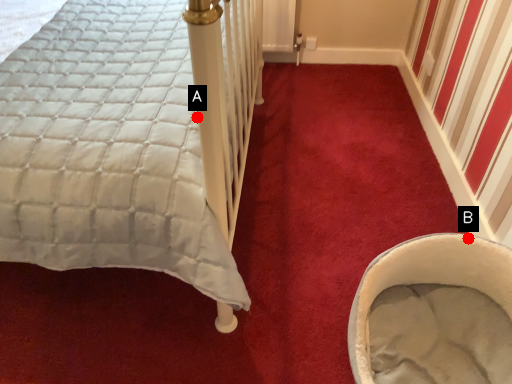
Question: Two points are circled on the image, labeled by A and B beside each circle. Among these points, which one is farthest from the camera?

Choices:
 (A) A is further
 (B) B is further

Answer: (B)